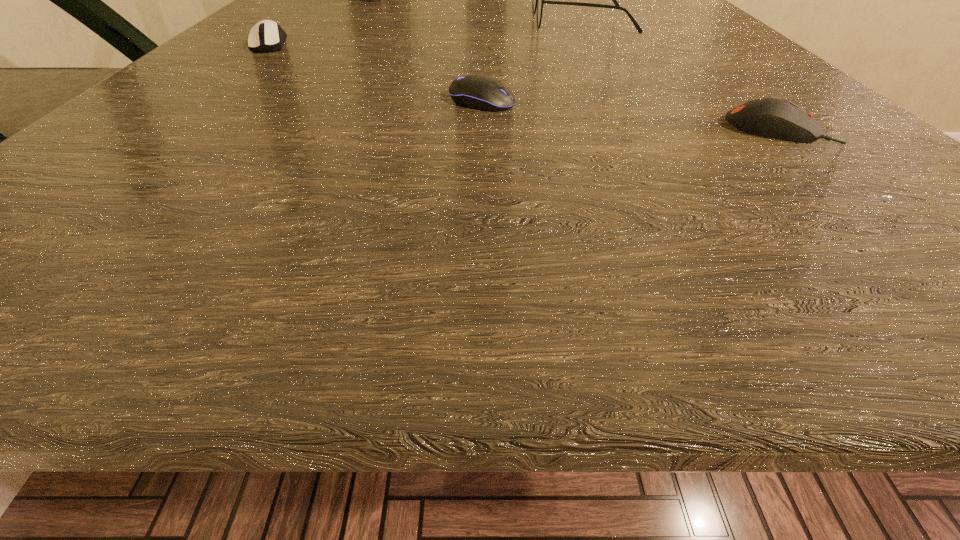
Select which object appears as the closest to the leftmost object. Please provide its 2D coordinates. Your answer should be formatted as a tuple, i.e. [(x, y)], where the tuple contains the x and y coordinates of a point satisfying the conditions above.

[(364, 0)]

Identify which object is located as the second nearest to the rightmost object. Please provide its 2D coordinates. Your answer should be formatted as a tuple, i.e. [(x, y)], where the tuple contains the x and y coordinates of a point satisfying the conditions above.

[(538, 0)]

Identify which computer mouse is the nearest to the fourth object from left to right. Please provide its 2D coordinates. Your answer should be formatted as a tuple, i.e. [(x, y)], where the tuple contains the x and y coordinates of a point satisfying the conditions above.

[(477, 92)]

Where is `computer mouse that is the closest one to the beer can`? The image size is (960, 540). computer mouse that is the closest one to the beer can is located at coordinates (270, 36).

Identify the location of free point that satisfies the following two spatial constraints: 1. on the front side of the fourth farthest object; 2. on the right side of the leftmost object. (209, 102).

Find the location of `free space in the image that satisfies the following two spatial constraints: 1. on the front-facing side of the second farthest object; 2. on the front side of the second computer mouse from right to left`. free space in the image that satisfies the following two spatial constraints: 1. on the front-facing side of the second farthest object; 2. on the front side of the second computer mouse from right to left is located at coordinates (631, 102).